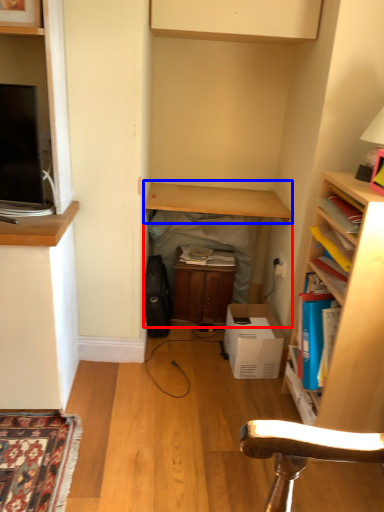
Question: Which of the following is the farthest to the observer, table (highlighted by a red box) or table (highlighted by a blue box)?

Choices:
 (A) table
 (B) table

Answer: (A)